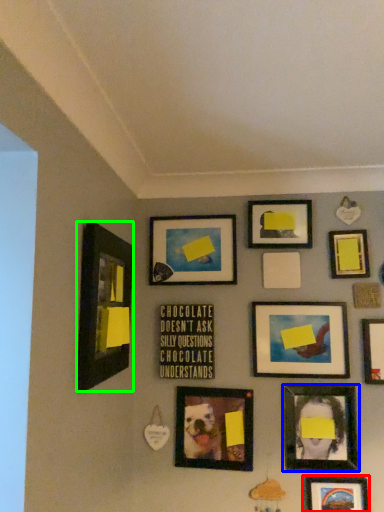
Question: Which object is the closest to the picture frame (highlighted by a red box)? Choose among these: picture frame (highlighted by a blue box) or picture frame (highlighted by a green box).

Choices:
 (A) picture frame
 (B) picture frame

Answer: (A)